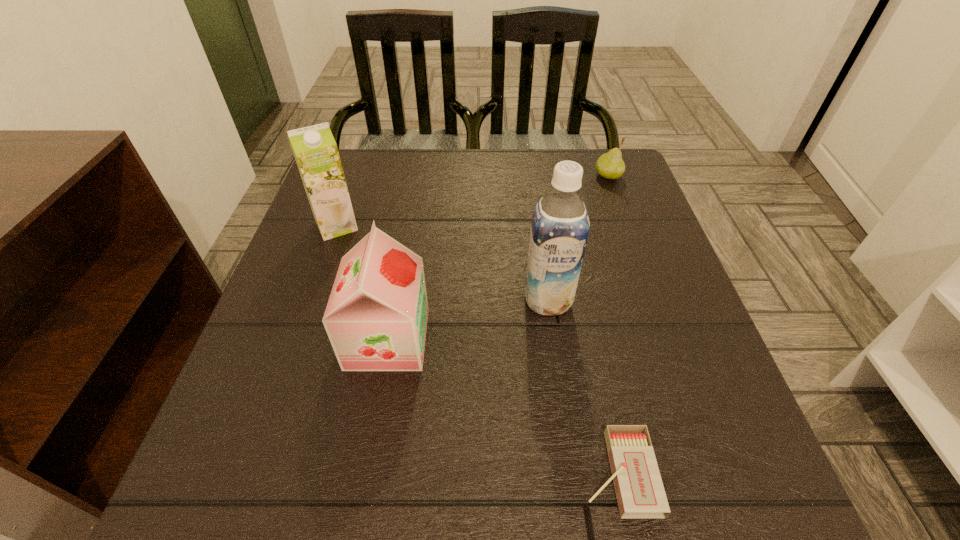
At what (x,y) coordinates should I click in order to perform the action: click on matchbox present at the right edge. Please return your answer as a coordinate pair (x, y). Looking at the image, I should click on (640, 493).

Where is `object that is at the far right corner`? The height and width of the screenshot is (540, 960). object that is at the far right corner is located at coordinates (610, 165).

Locate an element on the screen. Image resolution: width=960 pixels, height=540 pixels. object that is at the near right corner is located at coordinates (640, 493).

Identify the location of vacant region at the far edge. This screenshot has height=540, width=960. 488,181.

In the image, there is a desktop. Identify the location of vacant space at the near edge. 586,519.

This screenshot has height=540, width=960. What are the coordinates of `vacant area at the right edge of the desktop` in the screenshot? It's located at (631, 259).

In order to click on blank space at the far left corner of the desktop in this screenshot , I will do `click(383, 183)`.

Locate an element on the screen. The height and width of the screenshot is (540, 960). vacant space at the far right corner of the desktop is located at coordinates (617, 183).

You are a GUI agent. You are given a task and a screenshot of the screen. Output one action in this format:
    pyautogui.click(x=<x>, y=<y>)
    Task: Click on the free space between the rightmost soya milk and the fourth object from right to left
    
    Given the screenshot: What is the action you would take?
    pyautogui.click(x=468, y=319)

Identify the location of vacant area that lies between the leftmost soya milk and the tallest object. The height and width of the screenshot is (540, 960). (443, 263).